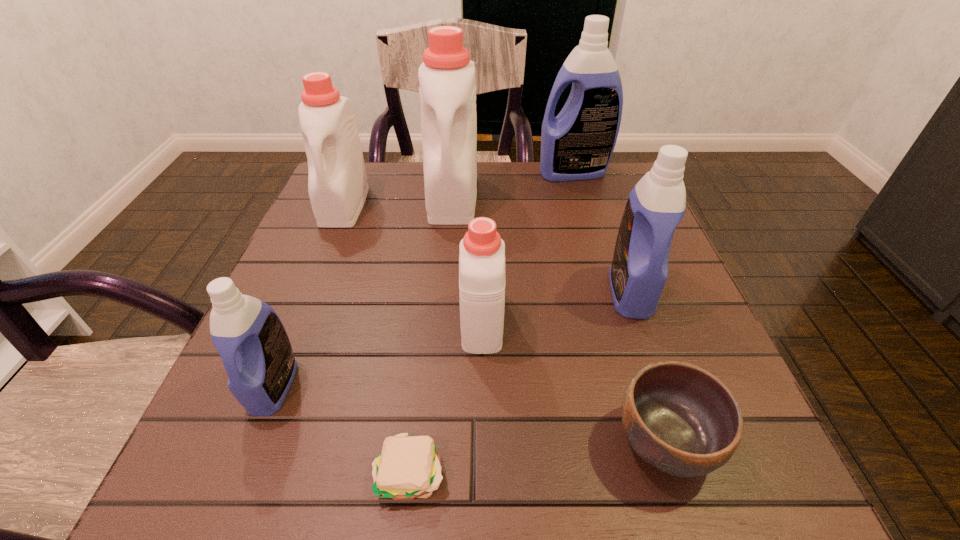
The image size is (960, 540). I want to click on vacant space that satisfies the following two spatial constraints: 1. on the handle side of the second smallest blue detergent; 2. on the left side of the biggest white detergent, so 444,292.